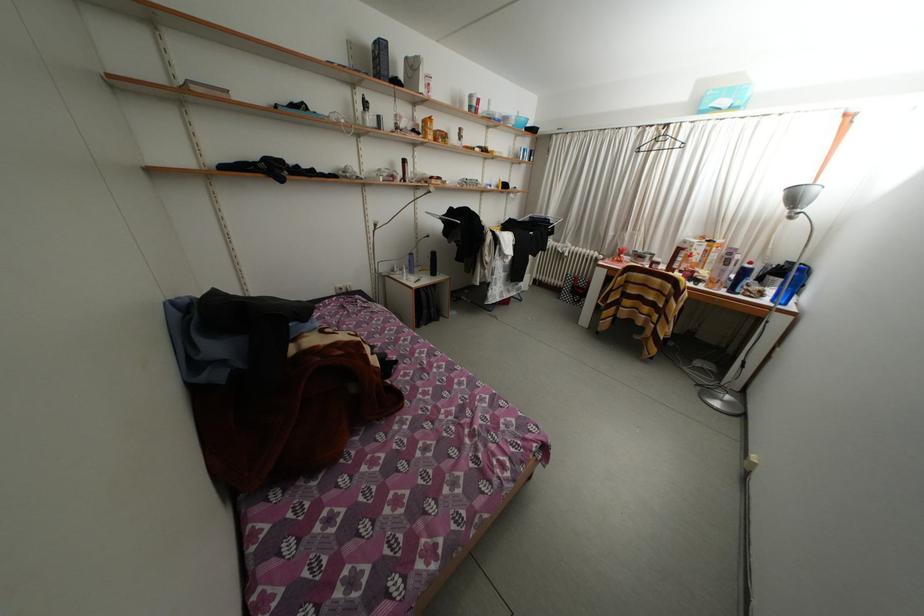
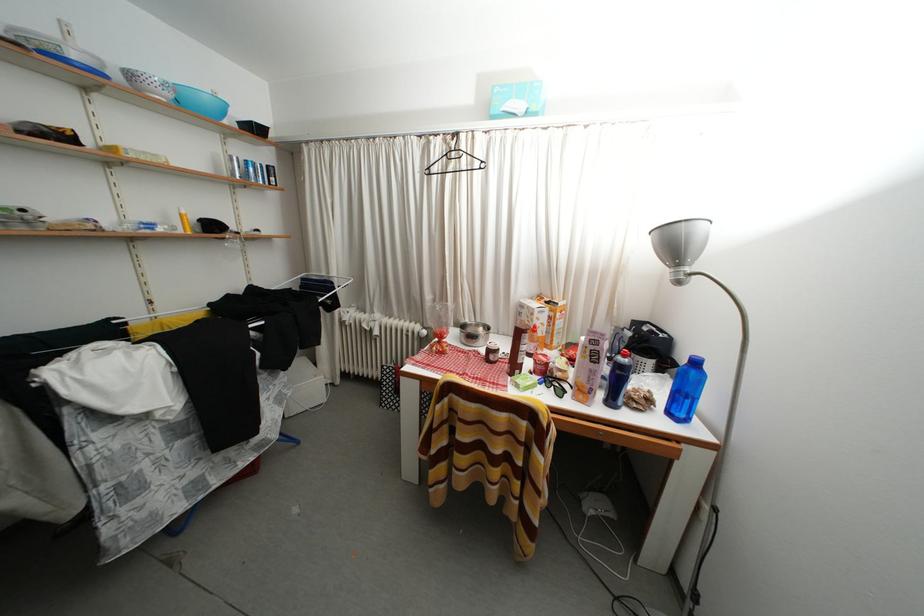
Locate, in the second image, the point that corresponds to [739,296] in the first image.

(618, 408)